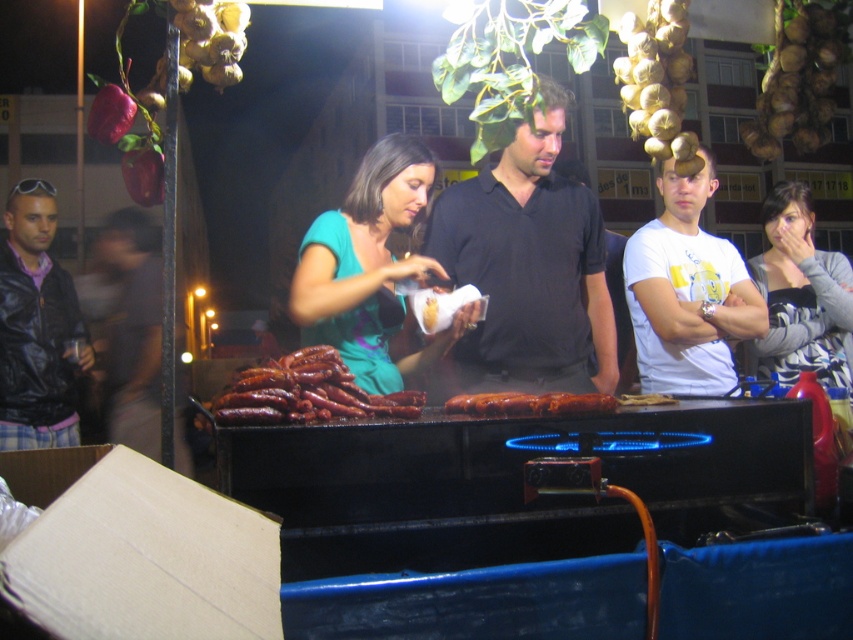
Is green matte shirt at center taller than white cotton t-shirt at center?

Incorrect, green matte shirt at center's height is not larger of white cotton t-shirt at center's.

Can you confirm if green matte shirt at center is wider than white cotton t-shirt at center?

Yes.

Identify the location of green matte shirt at center. (370, 268).

The height and width of the screenshot is (640, 853). Find the location of `green matte shirt at center`. green matte shirt at center is located at coordinates (370, 268).

Which is more to the left, striped fabric shirt at right or brown glossy sausages at center?

Positioned to the left is brown glossy sausages at center.

Can you confirm if striped fabric shirt at right is thinner than brown glossy sausages at center?

No, striped fabric shirt at right is not thinner than brown glossy sausages at center.

Image resolution: width=853 pixels, height=640 pixels. Find the location of `striped fabric shirt at right`. striped fabric shirt at right is located at coordinates (801, 296).

Can you confirm if white cotton t-shirt at center is thinner than golden brown onion at upper right?

In fact, white cotton t-shirt at center might be wider than golden brown onion at upper right.

Is point (718, 333) positioned in front of point (761, 83)?

Yes, point (718, 333) is in front of point (761, 83).

In order to click on white cotton t-shirt at center in this screenshot , I will do pos(688,292).